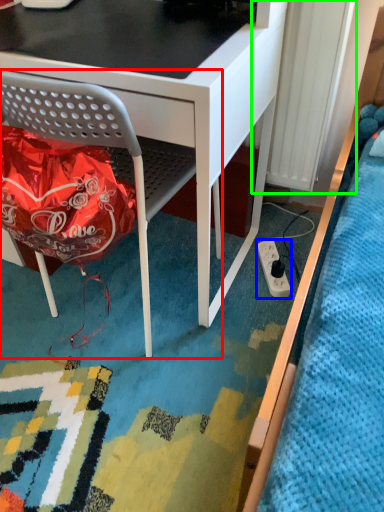
Question: Estimate the real-world distances between objects in this image. Which object is closer to chair (highlighted by a red box), power plugs and sockets (highlighted by a blue box) or radiator (highlighted by a green box)?

Choices:
 (A) power plugs and sockets
 (B) radiator

Answer: (B)